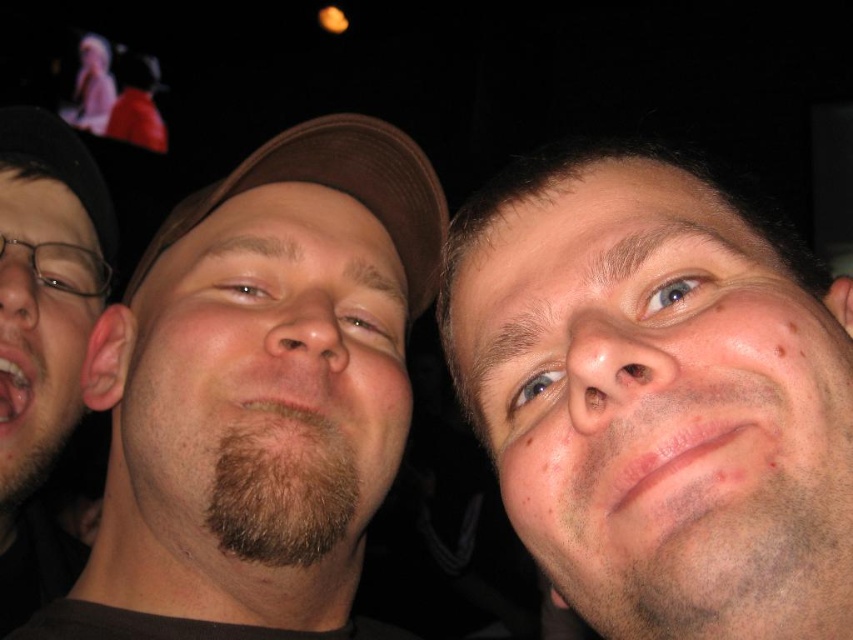
Looking at the three people in the image, which object is positioned lower on the central figure between the brown matte cap at center and the brown beard at center?

The brown matte cap at center is positioned below the brown beard at center, so it is lower on the central figure.

You are a photographer trying to capture a group photo. You want to ensure that the bearded man at left and the brown fabric baseball cap at center are both in focus. The camera you are using has a depth of field that can cover objects within a 30 cm range. Can you achieve this with your current setup?

The bearded man at left is 29.06 centimeters away from the brown fabric baseball cap at center. Since the distance between them is within the 30 cm range of the camera depth of field, both subjects will be in focus.

Based on the scene description, which object is larger in size between the bearded man at left and the brown fabric baseball cap at center?

The bearded man at left is bigger than the brown fabric baseball cap at center.